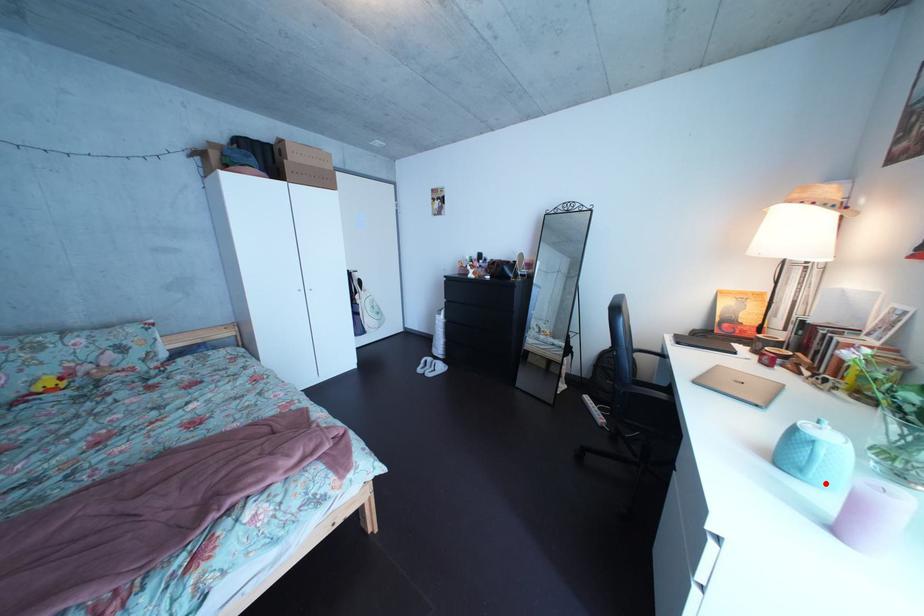
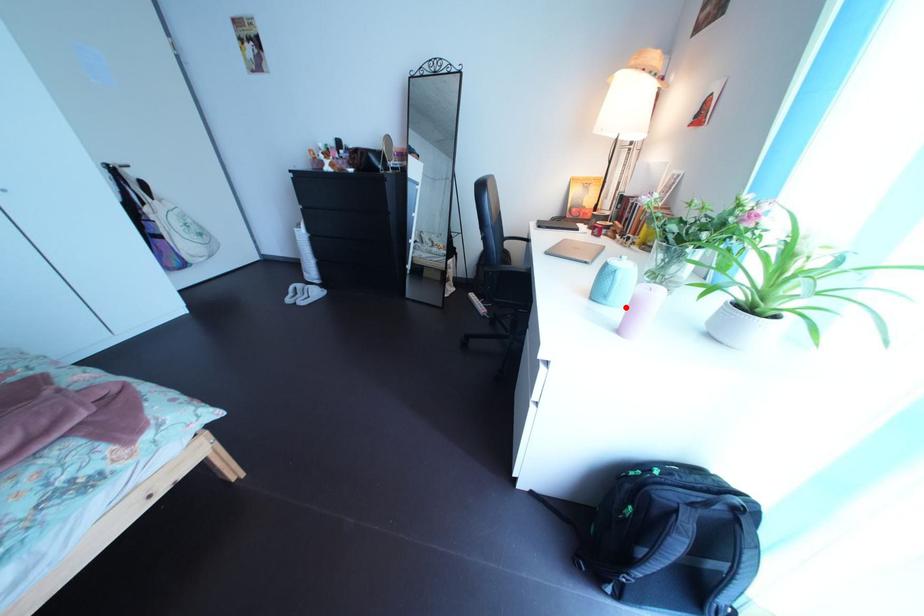
I am providing you with two images of the same scene from different viewpoints. A red point is marked on the first image and another point is marked on the second image. Is the red point in image1 aligned with the point shown in image2?

Yes